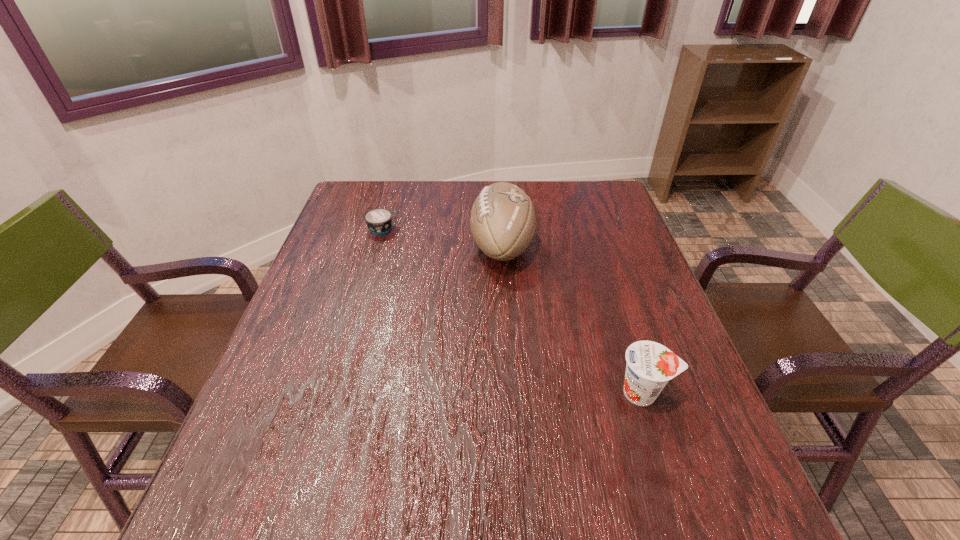
Find the location of a particular element. free space at the far right corner is located at coordinates (590, 202).

This screenshot has width=960, height=540. In order to click on empty space between the right yogurt and the shorter yogurt in this screenshot , I will do tap(513, 311).

You are a GUI agent. You are given a task and a screenshot of the screen. Output one action in this format:
    pyautogui.click(x=<x>, y=<y>)
    Task: Click on the vacant space that is in between the shortest object and the tallest object
    This screenshot has width=960, height=540.
    Given the screenshot: What is the action you would take?
    pyautogui.click(x=442, y=238)

Find the location of a particular element. The height and width of the screenshot is (540, 960). unoccupied position between the football (American) and the nearest object is located at coordinates (572, 320).

Locate an element on the screen. The image size is (960, 540). vacant area that lies between the shorter yogurt and the second object from left to right is located at coordinates (442, 238).

Identify the location of vacant space that's between the left yogurt and the taller yogurt. (513, 311).

Identify the location of vacant region between the nearer yogurt and the second object from right to left. (572, 320).

Find the location of a particular element. The height and width of the screenshot is (540, 960). empty space that is in between the farther yogurt and the tallest object is located at coordinates click(442, 238).

The width and height of the screenshot is (960, 540). What are the coordinates of `vacant space that is in between the second object from right to left and the taller yogurt` in the screenshot? It's located at 572,320.

Where is `free space between the second object from right to left and the second tallest object`? free space between the second object from right to left and the second tallest object is located at coordinates (572, 320).